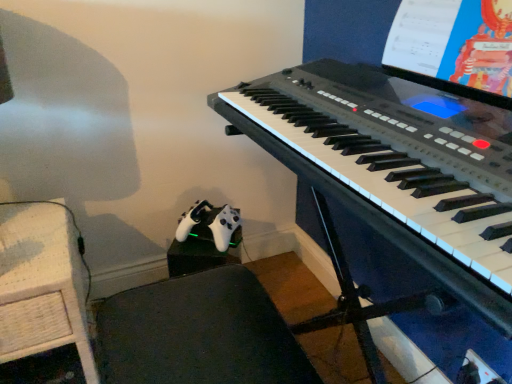
Describe the element at coordinates (42, 283) in the screenshot. The height and width of the screenshot is (384, 512). I see `woven wood table at lower left` at that location.

At what (x,y) coordinates should I click in order to perform the action: click on white paper at upper right. Please return your answer as a coordinate pair (x, y). This screenshot has height=384, width=512. Looking at the image, I should click on (454, 47).

This screenshot has height=384, width=512. Find the location of `black plastic keyboard at center`. black plastic keyboard at center is located at coordinates (398, 152).

Measure the distance from woven wood table at lower left to black plastic keyboard at center.

woven wood table at lower left is 27.53 inches from black plastic keyboard at center.

How different are the orientations of woven wood table at lower left and black plastic keyboard at center in degrees?

There is a 88.6-degree angle between the facing directions of woven wood table at lower left and black plastic keyboard at center.

Is woven wood table at lower left directly adjacent to black plastic keyboard at center?

No, woven wood table at lower left is not next to black plastic keyboard at center.

In the image, is woven wood table at lower left positioned in front of or behind black plastic keyboard at center?

woven wood table at lower left is positioned farther from the viewer than black plastic keyboard at center.

Is point (456, 168) positioned in front of point (74, 332)?

Yes, it is.

Is black plastic keyboard at center surrounding woven wood table at lower left?

Actually, woven wood table at lower left is outside black plastic keyboard at center.

The height and width of the screenshot is (384, 512). What are the coordinates of `musical keyboard above the woven wood table at lower left (from the image's perspective)` in the screenshot? It's located at (398, 152).

How much distance is there between black plastic keyboard at center and woven wood table at lower left?

black plastic keyboard at center and woven wood table at lower left are 27.53 inches apart.

Is white paper at upper right positioned with its back to woven wood table at lower left?

white paper at upper right does not have its back to woven wood table at lower left.

Considering the sizes of objects white paper at upper right and woven wood table at lower left in the image provided, who is taller, white paper at upper right or woven wood table at lower left?

woven wood table at lower left.

Do you think white paper at upper right is within woven wood table at lower left, or outside of it?

white paper at upper right is not enclosed by woven wood table at lower left.

Which object is further away from the camera, white paper at upper right or woven wood table at lower left?

woven wood table at lower left is further from the camera.

Is point (372, 111) closer to camera compared to point (492, 18)?

No, it is behind (492, 18).

Considering the sizes of objects black plastic keyboard at center and white paper at upper right in the image provided, who is shorter, black plastic keyboard at center or white paper at upper right?

black plastic keyboard at center.

Is black plastic keyboard at center positioned in front of white paper at upper right?

Yes.

Is white paper at upper right at the back of woven wood table at lower left?

That's not correct — woven wood table at lower left is not looking away from white paper at upper right.

Considering the relative positions of woven wood table at lower left and white paper at upper right in the image provided, is woven wood table at lower left behind white paper at upper right?

Yes, it is behind white paper at upper right.

Is woven wood table at lower left to the right of white paper at upper right from the viewer's perspective?

No, woven wood table at lower left is not to the right of white paper at upper right.

From the image's perspective, which one is positioned higher, woven wood table at lower left or white paper at upper right?

white paper at upper right, from the image's perspective.

From a real-world perspective, is white paper at upper right above or below black plastic keyboard at center?

Clearly, from a real-world perspective, white paper at upper right is above black plastic keyboard at center.

Can you tell me how much white paper at upper right and black plastic keyboard at center differ in facing direction?

They differ by 2.04 degrees in their facing directions.

Between white paper at upper right and black plastic keyboard at center, which one is positioned behind?

white paper at upper right is more distant.

At what (x,y) coordinates should I click in order to perform the action: click on computer screen lying on the right of black plastic keyboard at center. Please return your answer as a coordinate pair (x, y). Image resolution: width=512 pixels, height=384 pixels. Looking at the image, I should click on (454, 47).

Image resolution: width=512 pixels, height=384 pixels. What are the coordinates of `musical keyboard that appears in front of the woven wood table at lower left` in the screenshot? It's located at (398, 152).

Where is `musical keyboard that is on the right side of woven wood table at lower left`? musical keyboard that is on the right side of woven wood table at lower left is located at coordinates (398, 152).

Which object lies nearer to the anchor point white paper at upper right, woven wood table at lower left or black plastic keyboard at center?

black plastic keyboard at center.

Based on the photo, when comparing their distances from woven wood table at lower left, does black plastic keyboard at center or white paper at upper right seem closer?

black plastic keyboard at center.

Estimate the real-world distances between objects in this image. Which object is further from woven wood table at lower left, white paper at upper right or black plastic keyboard at center?

Among the two, white paper at upper right is located further to woven wood table at lower left.

Which object lies nearer to the anchor point black plastic keyboard at center, woven wood table at lower left or white paper at upper right?

Based on the image, white paper at upper right appears to be nearer to black plastic keyboard at center.

Estimate the real-world distances between objects in this image. Which object is further from black plastic keyboard at center, white paper at upper right or woven wood table at lower left?

Based on the image, woven wood table at lower left appears to be further to black plastic keyboard at center.

When comparing their distances from white paper at upper right, does black plastic keyboard at center or woven wood table at lower left seem closer?

black plastic keyboard at center lies closer to white paper at upper right than the other object.

Where is `musical keyboard between woven wood table at lower left and white paper at upper right from left to right`? The image size is (512, 384). musical keyboard between woven wood table at lower left and white paper at upper right from left to right is located at coordinates (398, 152).